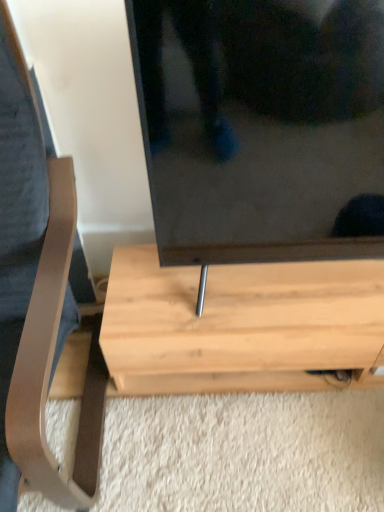
Question: Should I look upward or downward to see light brown wood coffee table at left?

Choices:
 (A) up
 (B) down

Answer: (B)

Question: Considering the relative sizes of light brown wood coffee table at left and light wood table at center in the image provided, is light brown wood coffee table at left taller than light wood table at center?

Choices:
 (A) no
 (B) yes

Answer: (B)

Question: Would you consider light brown wood coffee table at left to be distant from light wood table at center?

Choices:
 (A) no
 (B) yes

Answer: (A)

Question: Is the position of light brown wood coffee table at left more distant than that of light wood table at center?

Choices:
 (A) no
 (B) yes

Answer: (A)

Question: Considering the relative sizes of light brown wood coffee table at left and light wood table at center in the image provided, is light brown wood coffee table at left smaller than light wood table at center?

Choices:
 (A) yes
 (B) no

Answer: (B)

Question: Does light brown wood coffee table at left lie in front of light wood table at center?

Choices:
 (A) yes
 (B) no

Answer: (A)

Question: Does light brown wood coffee table at left have a larger size compared to light wood table at center?

Choices:
 (A) no
 (B) yes

Answer: (B)

Question: Can you confirm if light wood table at center is shorter than light brown wood coffee table at left?

Choices:
 (A) yes
 (B) no

Answer: (A)

Question: Is light wood table at center taller than light brown wood coffee table at left?

Choices:
 (A) no
 (B) yes

Answer: (A)

Question: Is light wood table at center at the right side of light brown wood coffee table at left?

Choices:
 (A) no
 (B) yes

Answer: (B)

Question: From a real-world perspective, is light wood table at center below light brown wood coffee table at left?

Choices:
 (A) no
 (B) yes

Answer: (B)

Question: From the image's perspective, is light wood table at center under light brown wood coffee table at left?

Choices:
 (A) no
 (B) yes

Answer: (B)

Question: Can you confirm if light wood table at center is positioned to the left of light brown wood coffee table at left?

Choices:
 (A) yes
 (B) no

Answer: (B)

Question: Relative to light wood table at center, is light brown wood coffee table at left in front or behind?

Choices:
 (A) behind
 (B) front

Answer: (B)